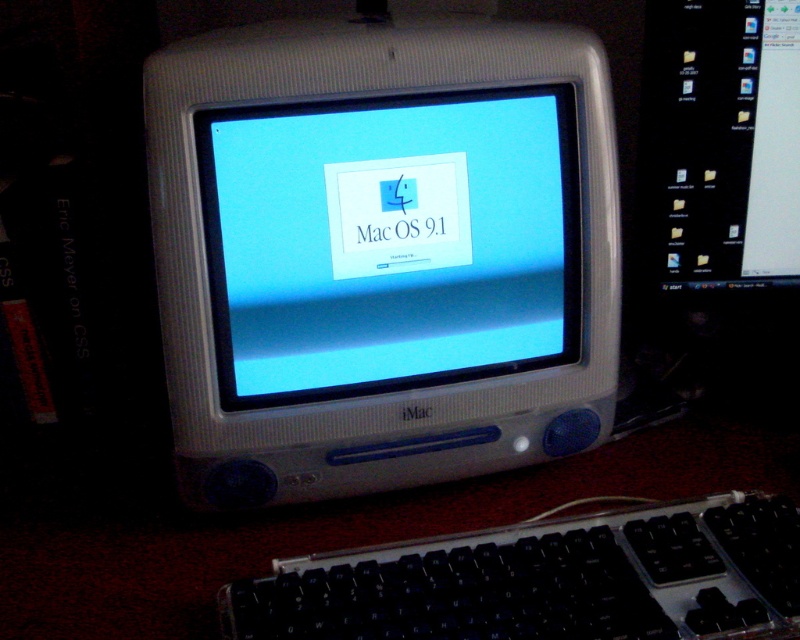
You are setting up a new desk and want to place a mouse between the white plastic imac at center and the black plastic keyboard at lower center. The mouse requires at least 10 inches of space to function properly. Based on the image, can the mouse fit in that space?

The white plastic imac at center is 9.88 inches away from the black plastic keyboard at lower center. Since the mouse requires at least 10 inches of space, the mouse cannot fit in that space as the distance is insufficient.

Where is the satin silver imac at center located in the image?

The satin silver imac at center is located at point (x=310, y=524).